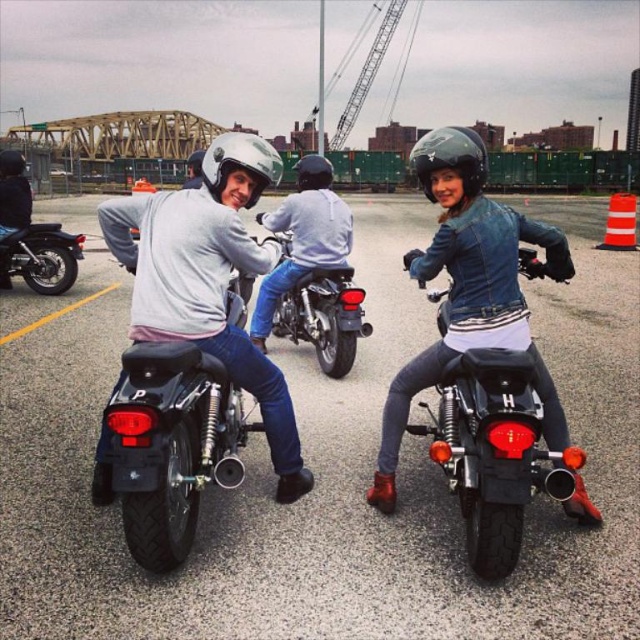
You are a photographer standing at the edge of the parking lot. You want to take a photo that includes both the denim jacket at center and the shiny black motorcycle at center. Based on their positions, which object should appear lower in the photo?

The denim jacket at center is positioned below the shiny black motorcycle at center, so in the photo, the denim jacket at center will appear lower than the shiny black motorcycle at center.

You are a motorcycle instructor standing at the edge of the parking lot. You want to move the shiny black motorcycle at center closer to the matte white helmet at center so that they are only 2 meters apart. Is this possible without moving any other objects in the scene?

The shiny black motorcycle at center and matte white helmet at center are currently 3.82 meters apart. To reduce the distance to 2 meters, you would need to move the motorcycle forward by 1.82 meters. Since there are no mentioned obstacles in the scene description, this adjustment should be feasible.